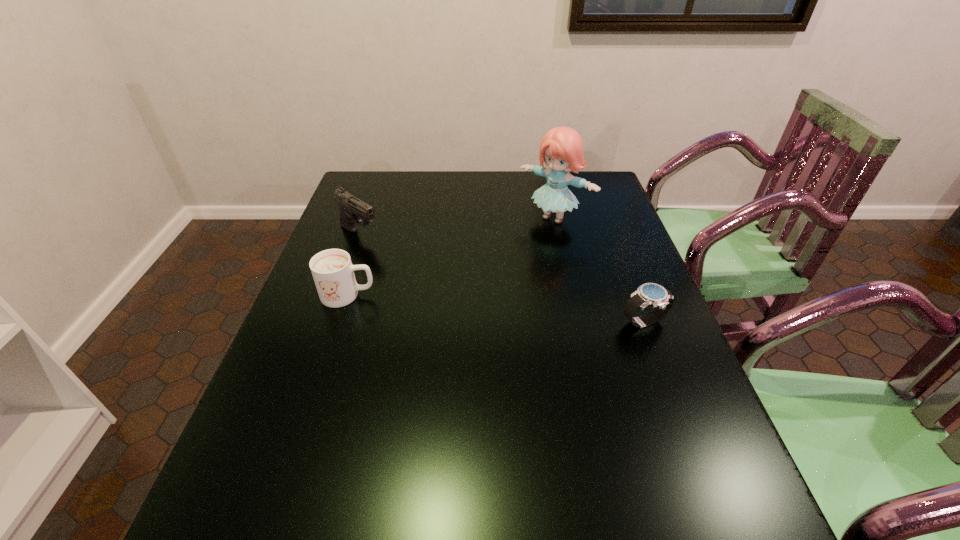
Image resolution: width=960 pixels, height=540 pixels. I want to click on free location located at the barrel of the third shortest object, so click(x=452, y=297).

Identify the location of vacant space located at the barrel of the third shortest object. This screenshot has width=960, height=540. (449, 295).

I want to click on object present at the far edge, so click(561, 148).

At what (x,y) coordinates should I click in order to perform the action: click on cappuccino that is positioned at the left edge. Please return your answer as a coordinate pair (x, y). The image size is (960, 540). Looking at the image, I should click on (332, 270).

Image resolution: width=960 pixels, height=540 pixels. I want to click on pistol at the left edge, so click(353, 211).

You are a GUI agent. You are given a task and a screenshot of the screen. Output one action in this format:
    pyautogui.click(x=<x>, y=<y>)
    Task: Click on the watch that is at the right edge
    
    Given the screenshot: What is the action you would take?
    pyautogui.click(x=653, y=295)

I want to click on doll that is at the right edge, so tap(561, 148).

The image size is (960, 540). Identify the location of object that is at the far right corner. (561, 148).

What are the coordinates of `vacant space at the far edge of the desktop` in the screenshot? It's located at (541, 177).

This screenshot has width=960, height=540. I want to click on vacant space at the near edge of the desktop, so click(424, 465).